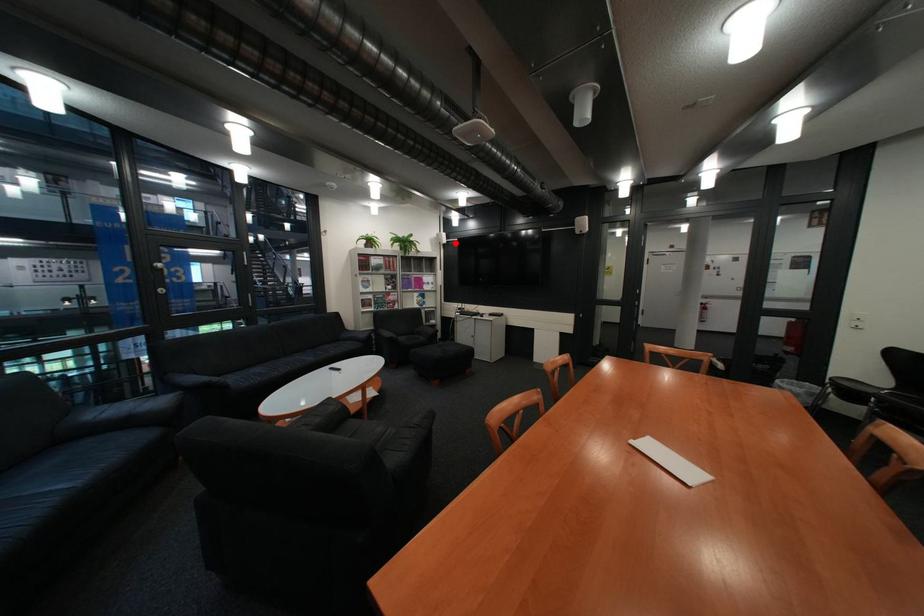
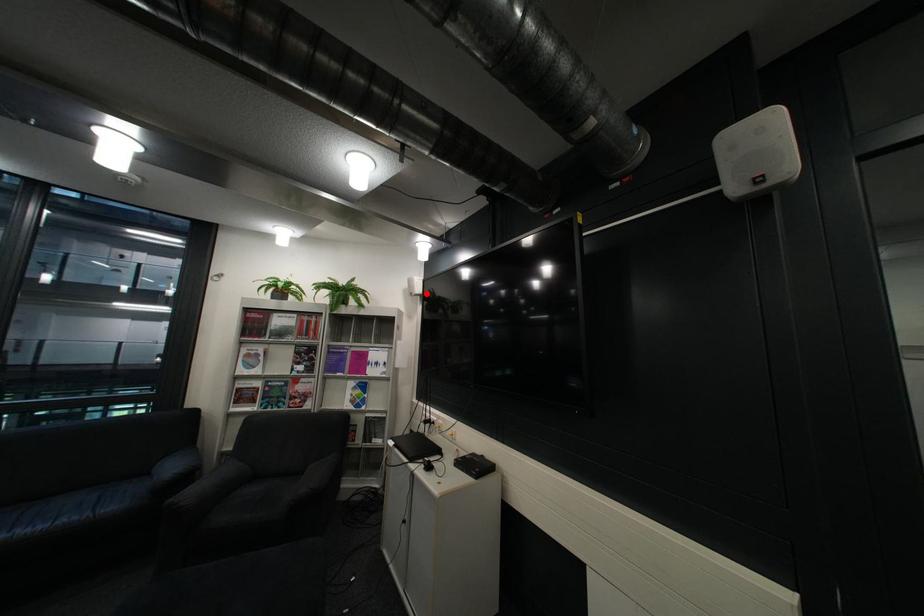
I am providing you with two images of the same scene from different viewpoints. A red point is marked on the first image and another point is marked on the second image. Does the point marked in image1 correspond to the same location as the one in image2?

Yes